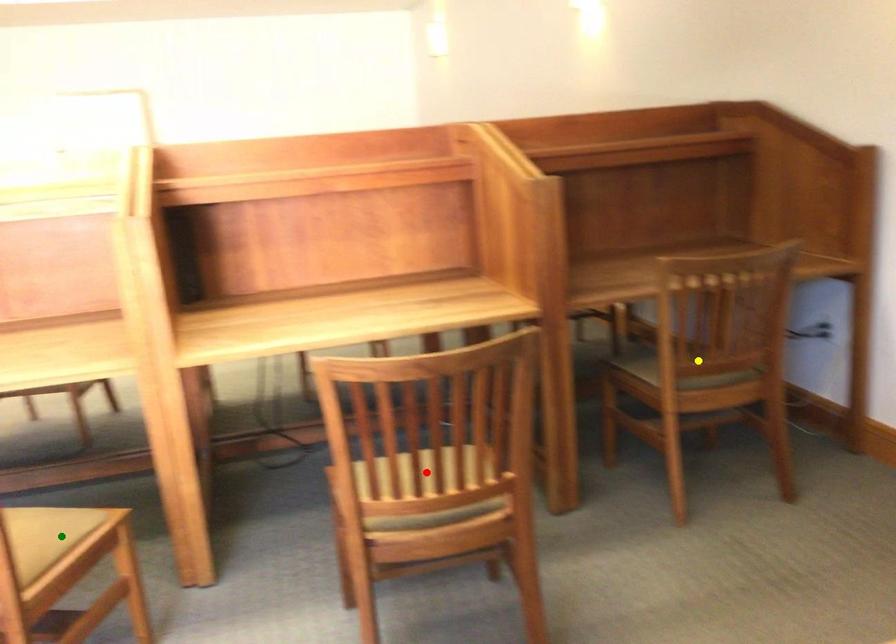
Order these from nearest to farthest:
A) red point
B) green point
C) yellow point

red point
green point
yellow point